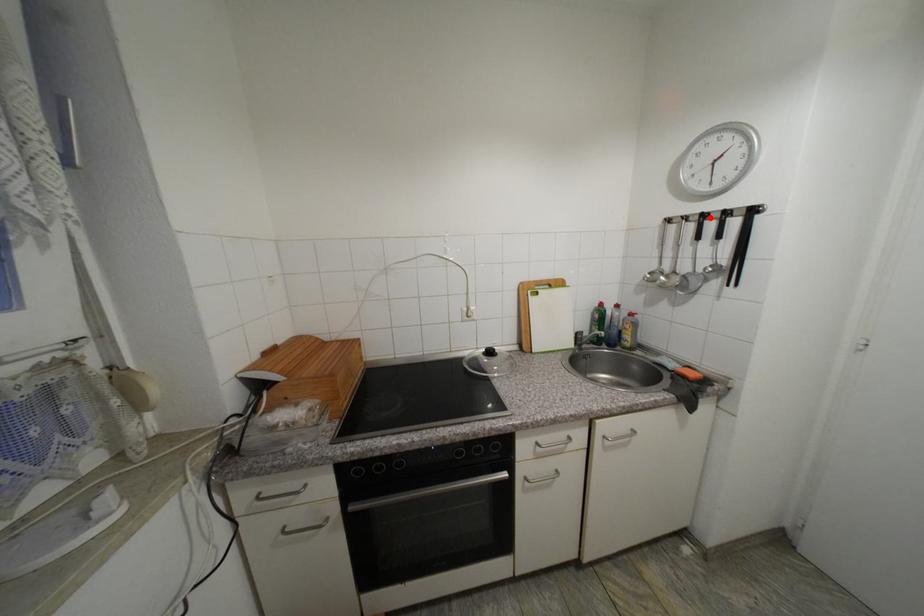
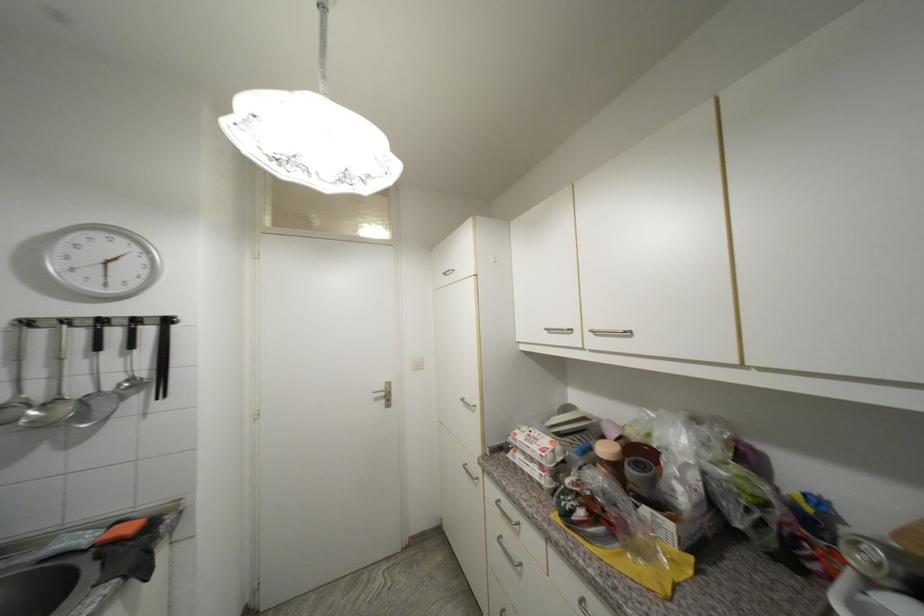
The point at the highlighted location is marked in the first image. Where is the corresponding point in the second image?

(108, 323)